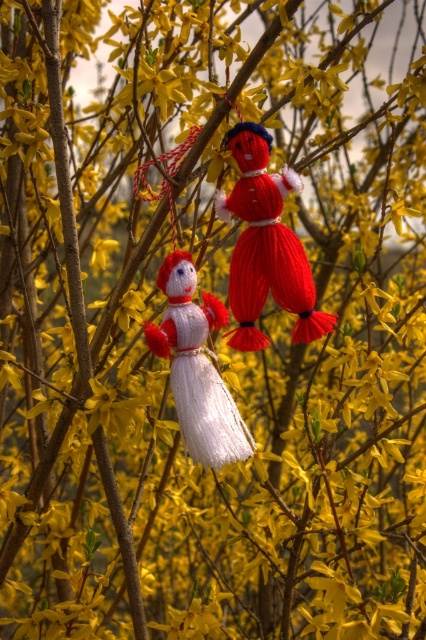
Question: Can you confirm if knitted red doll at center is wider than knitted white doll at center?

Choices:
 (A) no
 (B) yes

Answer: (B)

Question: Which object is farther from the camera taking this photo?

Choices:
 (A) knitted red doll at center
 (B) knitted white doll at center

Answer: (A)

Question: Which object appears closest to the camera in this image?

Choices:
 (A) knitted white doll at center
 (B) knitted red doll at center

Answer: (A)

Question: Is knitted red doll at center wider than knitted white doll at center?

Choices:
 (A) no
 (B) yes

Answer: (B)

Question: Can you confirm if knitted red doll at center is positioned to the left of knitted white doll at center?

Choices:
 (A) no
 (B) yes

Answer: (A)